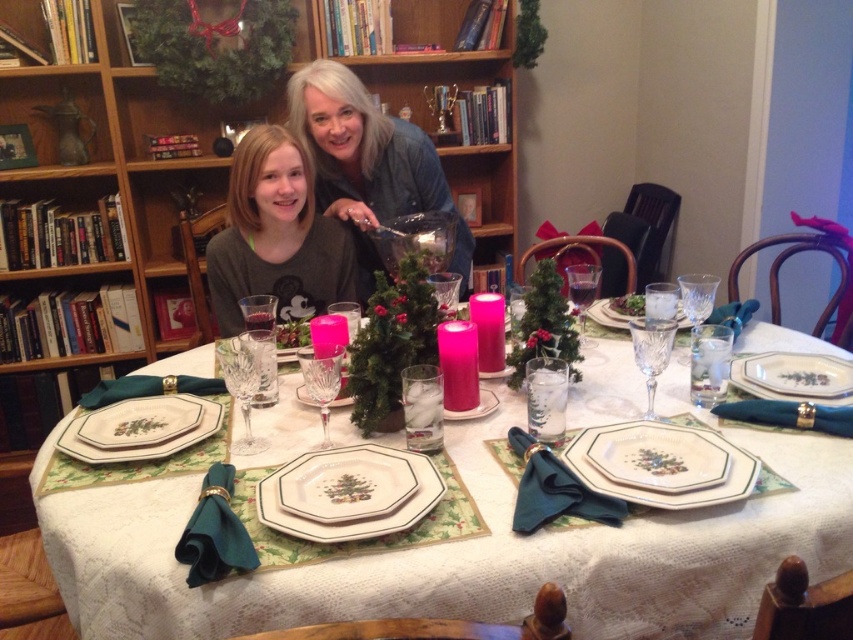
Is wooden bookshelf at upper left above matte gray shirt at center?

Incorrect, wooden bookshelf at upper left is not positioned above matte gray shirt at center.

Who is more forward, (352, 81) or (257, 240)?

Point (257, 240)

Where is `wooden bookshelf at upper left`? The image size is (853, 640). wooden bookshelf at upper left is located at coordinates (107, 224).

Does porcelain plates at center appear over matte blue denim jacket at upper center?

Incorrect, porcelain plates at center is not positioned above matte blue denim jacket at upper center.

Is porcelain plates at center behind matte blue denim jacket at upper center?

No, it is in front of matte blue denim jacket at upper center.

Between point (593, 365) and point (347, 115), which one is positioned in front?

Positioned in front is point (593, 365).

In order to click on porcelain plates at center in this screenshot , I will do `click(461, 554)`.

Which of these two, matte gray shirt at center or white ceramic plate at center, stands shorter?

white ceramic plate at center is shorter.

Can you confirm if matte gray shirt at center is bigger than white ceramic plate at center?

Indeed, matte gray shirt at center has a larger size compared to white ceramic plate at center.

Image resolution: width=853 pixels, height=640 pixels. What do you see at coordinates (276, 236) in the screenshot?
I see `matte gray shirt at center` at bounding box center [276, 236].

At what (x,y) coordinates should I click in order to perform the action: click on matte gray shirt at center. Please return your answer as a coordinate pair (x, y). The width and height of the screenshot is (853, 640). Looking at the image, I should click on (276, 236).